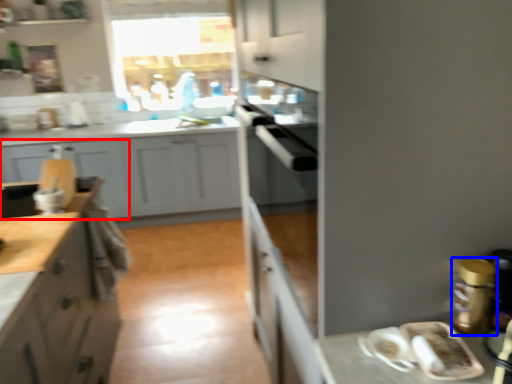
Question: Which point is closer to the camera, cabinetry (highlighted by a red box) or appliance (highlighted by a blue box)?

Choices:
 (A) cabinetry
 (B) appliance

Answer: (B)